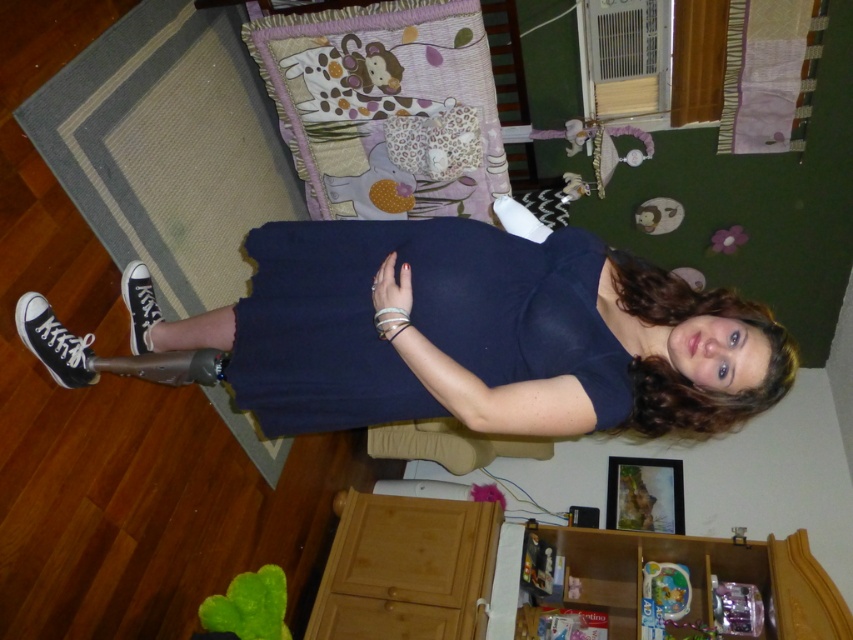
Question: Does pastel patchwork pillow at upper center have a smaller size compared to wooden drawer at lower center?

Choices:
 (A) no
 (B) yes

Answer: (A)

Question: Which of the following is the farthest from the observer?

Choices:
 (A) pastel patchwork pillow at upper center
 (B) navy blue fabric dress at center
 (C) wooden cabinet at lower center
 (D) navy blue dress at center

Answer: (A)

Question: Which object is positioned closest to the navy blue fabric dress at center?

Choices:
 (A) navy blue dress at center
 (B) wooden drawer at lower center
 (C) wooden cabinet at lower center

Answer: (A)

Question: Does navy blue fabric dress at center appear under wooden cabinet at lower center?

Choices:
 (A) no
 (B) yes

Answer: (A)

Question: Considering the relative positions of navy blue fabric dress at center and pastel patchwork pillow at upper center in the image provided, where is navy blue fabric dress at center located with respect to pastel patchwork pillow at upper center?

Choices:
 (A) above
 (B) below

Answer: (B)

Question: Estimate the real-world distances between objects in this image. Which object is farther from the pastel patchwork pillow at upper center?

Choices:
 (A) wooden cabinet at lower center
 (B) wooden drawer at lower center
 (C) navy blue dress at center
 (D) navy blue fabric dress at center

Answer: (A)